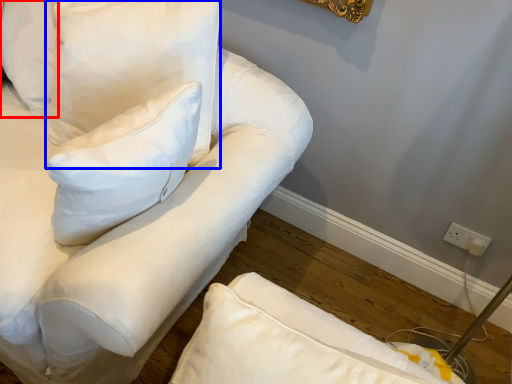
Question: Which point is closer to the camera, pillow (highlighted by a red box) or pillow (highlighted by a blue box)?

Choices:
 (A) pillow
 (B) pillow

Answer: (B)